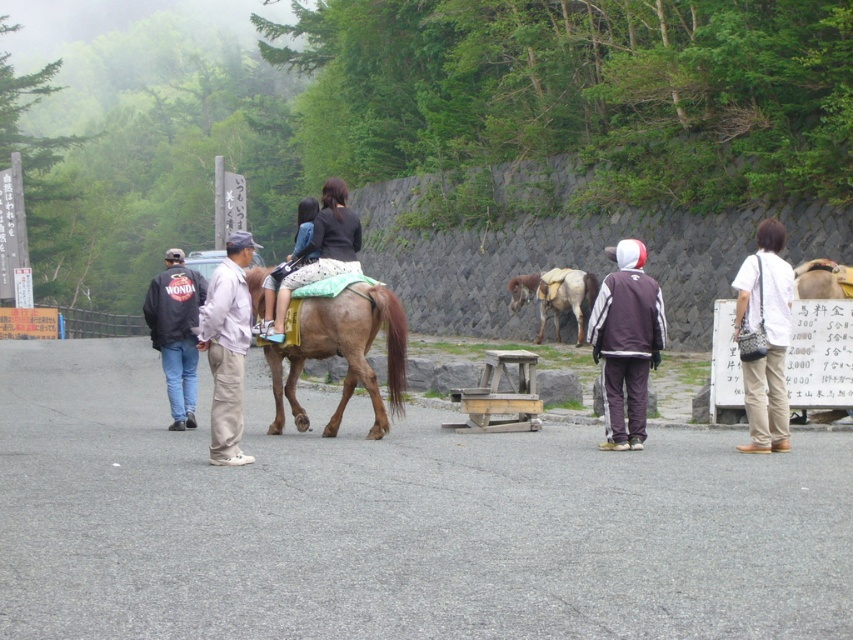
Question: Which of the following is the farthest from the observer?

Choices:
 (A) (761, 378)
 (B) (576, 307)
 (C) (164, 628)
 (D) (387, 332)

Answer: (B)

Question: Can you confirm if brown horse at center is wider than brown velour jacket at center?

Choices:
 (A) no
 (B) yes

Answer: (B)

Question: Can you confirm if light brown cotton pants at center is bigger than brown leather saddle at center?

Choices:
 (A) no
 (B) yes

Answer: (A)

Question: Which point is closer to the camera?

Choices:
 (A) matte black jacket at center
 (B) light brown cotton pants at center
 (C) white cotton shirt at lower right
 (D) brown glossy horse at center

Answer: (B)

Question: Which object appears farthest from the camera in this image?

Choices:
 (A) brown horse at center
 (B) brown glossy horse at center
 (C) light brown cotton pants at center

Answer: (B)

Question: Does brown horse at center appear over brown velour jacket at center?

Choices:
 (A) yes
 (B) no

Answer: (B)